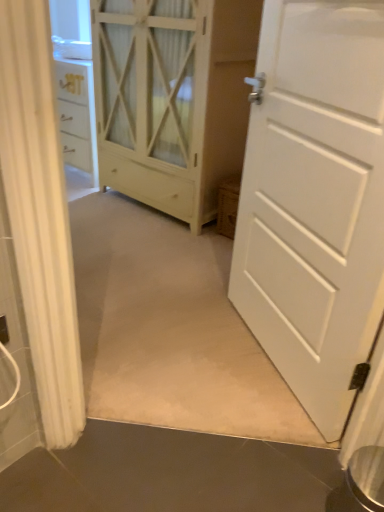
I want to click on vacant space that is to the left of white matte door at right, so click(x=178, y=346).